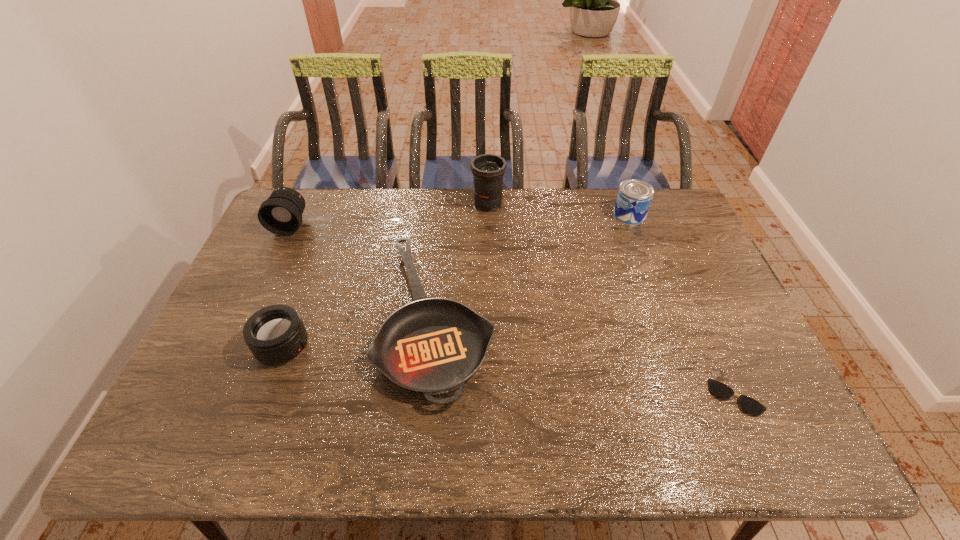
Locate an element on the screen. Image resolution: width=960 pixels, height=540 pixels. the tallest object is located at coordinates (487, 169).

At what (x,y) coordinates should I click in order to perform the action: click on the rightmost telephoto lens. Please return your answer as a coordinate pair (x, y). Looking at the image, I should click on (487, 169).

Identify the location of the second tallest object. The image size is (960, 540). (281, 214).

Find the location of a particular element. can is located at coordinates (634, 197).

Where is `the shortest telephoto lens`? the shortest telephoto lens is located at coordinates (276, 334).

Locate an element on the screen. the nearest telephoto lens is located at coordinates pyautogui.click(x=276, y=334).

The height and width of the screenshot is (540, 960). In order to click on frying pan in this screenshot , I will do [432, 346].

Where is `the shortest object`? the shortest object is located at coordinates (719, 389).

Find the location of `free space located 0.280m on the front of the rightmost telephoto lens`. free space located 0.280m on the front of the rightmost telephoto lens is located at coordinates (490, 271).

Identify the location of free space located 0.350m at the front element of the second tallest telephoto lens. This screenshot has height=540, width=960. (246, 320).